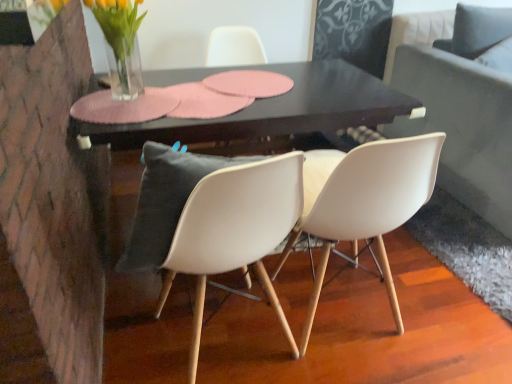
Question: Is white plastic chair at center, acting as the third chair starting from the front, not close to black glossy table at center?

Choices:
 (A) no
 (B) yes

Answer: (A)

Question: Is the depth of white plastic chair at center, the first chair from the back, less than that of black glossy table at center?

Choices:
 (A) no
 (B) yes

Answer: (A)

Question: Could you tell me if white plastic chair at center, acting as the third chair starting from the front, is facing black glossy table at center?

Choices:
 (A) no
 (B) yes

Answer: (B)

Question: Is white plastic chair at center, acting as the third chair starting from the front, shorter than black glossy table at center?

Choices:
 (A) yes
 (B) no

Answer: (B)

Question: Can you confirm if white plastic chair at center, acting as the third chair starting from the front, is bigger than black glossy table at center?

Choices:
 (A) yes
 (B) no

Answer: (B)

Question: From a real-world perspective, is white plastic chair at center, acting as the third chair starting from the front, positioned over black glossy table at center based on gravity?

Choices:
 (A) no
 (B) yes

Answer: (B)

Question: Is black glossy table at center positioned far away from white matte chair at center, which is counted as the 2th chair, starting from the front?

Choices:
 (A) yes
 (B) no

Answer: (B)

Question: From the image's perspective, is black glossy table at center below white matte chair at center, which is counted as the 2th chair, starting from the front?

Choices:
 (A) yes
 (B) no

Answer: (B)

Question: Does black glossy table at center have a lesser height compared to white matte chair at center, which is counted as the 2th chair, starting from the front?

Choices:
 (A) yes
 (B) no

Answer: (A)

Question: From the image's perspective, is black glossy table at center above white matte chair at center, which is counted as the 2th chair, starting from the front?

Choices:
 (A) no
 (B) yes

Answer: (B)

Question: Does black glossy table at center have a greater width compared to white matte chair at center, the 2th chair when ordered from back to front?

Choices:
 (A) yes
 (B) no

Answer: (A)

Question: Is black glossy table at center directly adjacent to white matte chair at center, which is counted as the 2th chair, starting from the front?

Choices:
 (A) yes
 (B) no

Answer: (B)

Question: From the image's perspective, would you say white plastic chair at center, acting as the third chair starting from the front, is shown under clear glass vase at upper left?

Choices:
 (A) no
 (B) yes

Answer: (B)